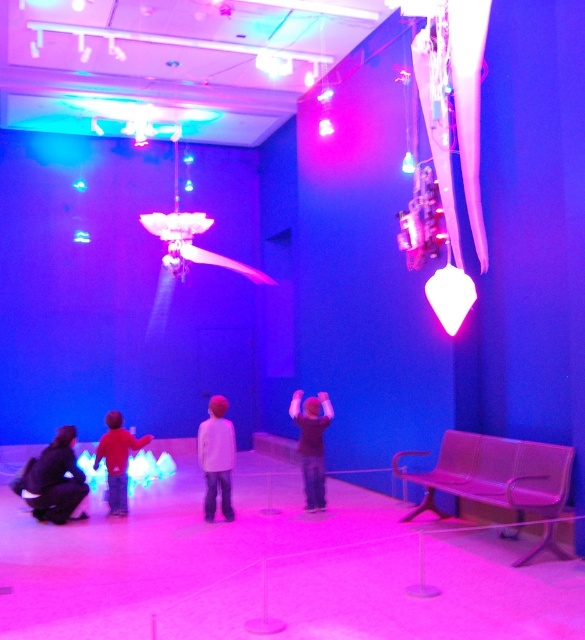
Question: Which object is the closest to the red cotton shirt at lower left?

Choices:
 (A) white matte shirt at center
 (B) black matte shirt at center
 (C) dark gray fabric at lower left

Answer: (C)

Question: Which point is farther from the camera taking this photo?

Choices:
 (A) (60, 461)
 (B) (308, 508)
 (C) (215, 474)

Answer: (B)

Question: Can you confirm if white matte shirt at center is wider than red cotton shirt at lower left?

Choices:
 (A) yes
 (B) no

Answer: (B)

Question: Which point is closer to the camera?

Choices:
 (A) white matte shirt at center
 (B) red cotton shirt at lower left

Answer: (A)

Question: Is white matte shirt at center above red cotton shirt at lower left?

Choices:
 (A) yes
 (B) no

Answer: (A)

Question: Does dark gray fabric at lower left have a smaller size compared to red cotton shirt at lower left?

Choices:
 (A) no
 (B) yes

Answer: (B)